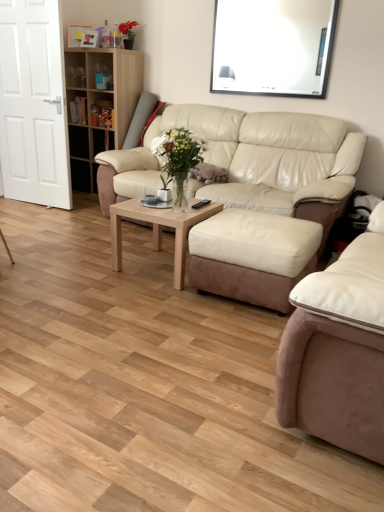
The height and width of the screenshot is (512, 384). I want to click on vacant space underneath light brown wood coffee table at center (from a real-world perspective), so [158, 261].